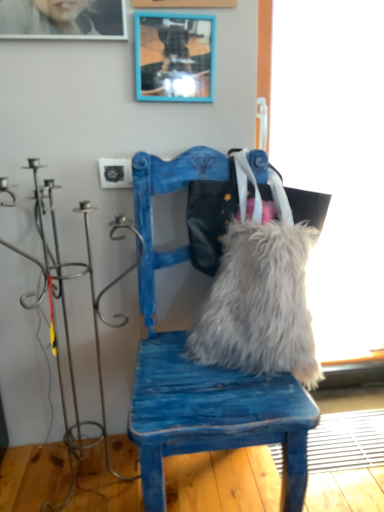
Question: Is the position of blue painted wood picture frame at upper center less distant than that of blue distressed wood chair at center?

Choices:
 (A) yes
 (B) no

Answer: (B)

Question: Considering the relative positions of blue painted wood picture frame at upper center and blue distressed wood chair at center in the image provided, is blue painted wood picture frame at upper center to the right of blue distressed wood chair at center from the viewer's perspective?

Choices:
 (A) no
 (B) yes

Answer: (A)

Question: Is blue painted wood picture frame at upper center positioned with its back to blue distressed wood chair at center?

Choices:
 (A) yes
 (B) no

Answer: (B)

Question: Is blue painted wood picture frame at upper center shorter than blue distressed wood chair at center?

Choices:
 (A) no
 (B) yes

Answer: (B)

Question: Is blue painted wood picture frame at upper center smaller than blue distressed wood chair at center?

Choices:
 (A) no
 (B) yes

Answer: (B)

Question: Does blue painted wood picture frame at upper center have a greater height compared to blue distressed wood chair at center?

Choices:
 (A) yes
 (B) no

Answer: (B)

Question: Does white fluffy pillow at center come in front of blue distressed wood chair at center?

Choices:
 (A) no
 (B) yes

Answer: (A)

Question: Is there a large distance between white fluffy pillow at center and blue distressed wood chair at center?

Choices:
 (A) yes
 (B) no

Answer: (B)

Question: From a real-world perspective, does white fluffy pillow at center stand above blue distressed wood chair at center?

Choices:
 (A) no
 (B) yes

Answer: (A)

Question: Is white fluffy pillow at center facing away from blue distressed wood chair at center?

Choices:
 (A) no
 (B) yes

Answer: (B)

Question: Can you confirm if white fluffy pillow at center is taller than blue distressed wood chair at center?

Choices:
 (A) no
 (B) yes

Answer: (A)

Question: From the image's perspective, is white fluffy pillow at center beneath blue distressed wood chair at center?

Choices:
 (A) no
 (B) yes

Answer: (B)

Question: Does blue distressed wood chair at center lie in front of fuzzy fabric messenger bag at center?

Choices:
 (A) yes
 (B) no

Answer: (A)